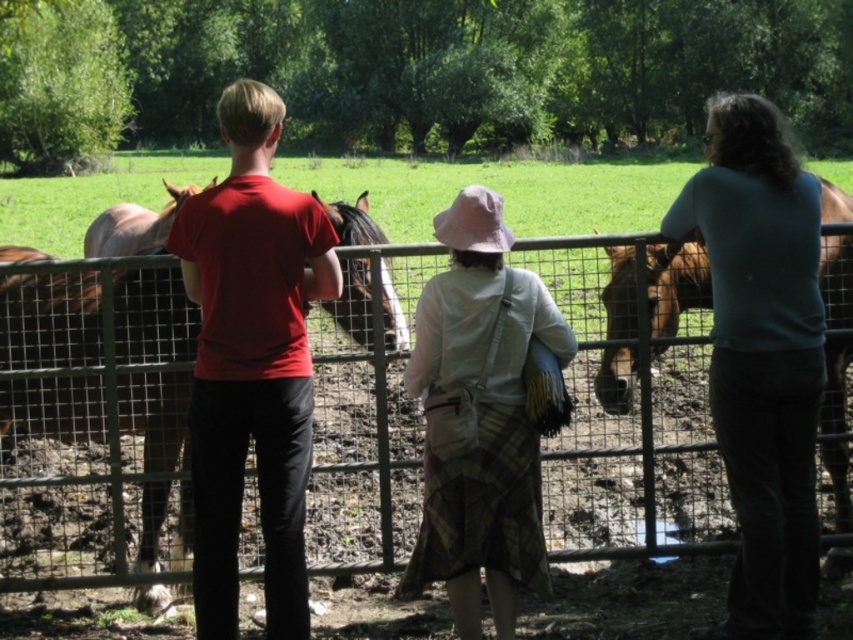
Is point (648, 490) less distant than point (462, 216)?

No, it is not.

Between point (254, 556) and point (467, 230), which one is positioned in front?

Point (467, 230) is in front.

Between point (415, 438) and point (461, 241), which one is positioned behind?

The point (415, 438) is more distant.

Locate an element on the screen. metal wire fence at center is located at coordinates (91, 420).

How distant is plaid fabric skirt at center from brown glossy horse at right?

plaid fabric skirt at center and brown glossy horse at right are 1.76 meters apart.

Is point (463, 557) more distant than point (627, 400)?

That is False.

Does point (468, 244) lie behind point (622, 376)?

No, it is in front of (622, 376).

At what (x,y) coordinates should I click in order to perform the action: click on plaid fabric skirt at center. Please return your answer as a coordinate pair (x, y). The width and height of the screenshot is (853, 640). Looking at the image, I should click on (479, 419).

Is metal wire fence at center to the left of matte red t-shirt at center from the viewer's perspective?

Incorrect, metal wire fence at center is not on the left side of matte red t-shirt at center.

Who is shorter, metal wire fence at center or matte red t-shirt at center?

With less height is metal wire fence at center.

At what (x,y) coordinates should I click in order to perform the action: click on metal wire fence at center. Please return your answer as a coordinate pair (x, y). This screenshot has height=640, width=853. Looking at the image, I should click on (91, 420).